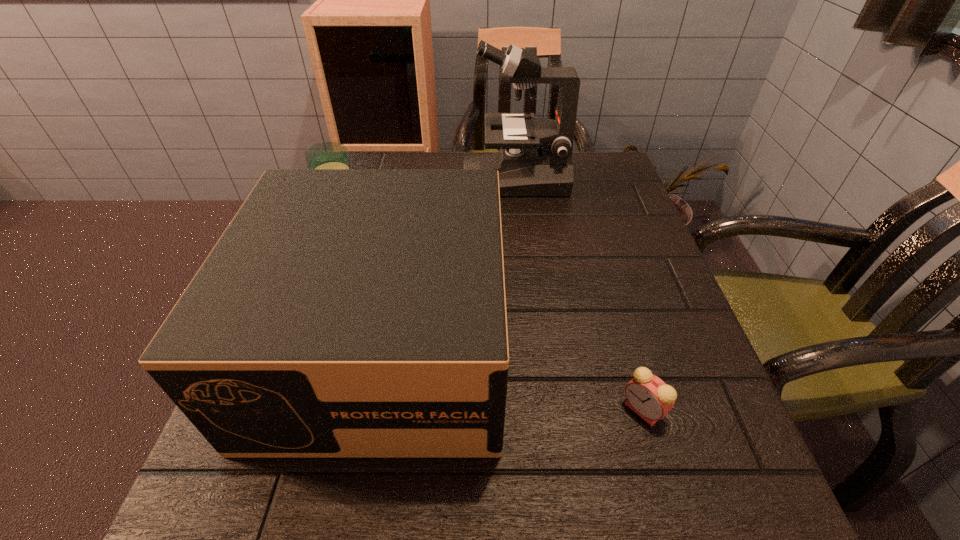
Identify the location of free space located on the right of the second shortest object. (464, 211).

What are the coordinates of `free space located on the face of the alarm clock` in the screenshot? It's located at (494, 410).

Locate an element on the screen. The height and width of the screenshot is (540, 960). free space located on the face of the alarm clock is located at coordinates (397, 410).

Find the location of a particular element. The height and width of the screenshot is (540, 960). free space located on the face of the alarm clock is located at coordinates (539, 410).

Where is `object situated at the far edge`? This screenshot has height=540, width=960. object situated at the far edge is located at coordinates 535,159.

Identify the location of box at the left edge. This screenshot has height=540, width=960. (344, 313).

Identify the location of glass present at the left edge. (327, 155).

Image resolution: width=960 pixels, height=540 pixels. Identify the location of microscope at the right edge. (535, 159).

This screenshot has height=540, width=960. Identify the location of alarm clock positioned at the right edge. (648, 396).

This screenshot has width=960, height=540. In order to click on object at the far right corner in this screenshot , I will do `click(535, 159)`.